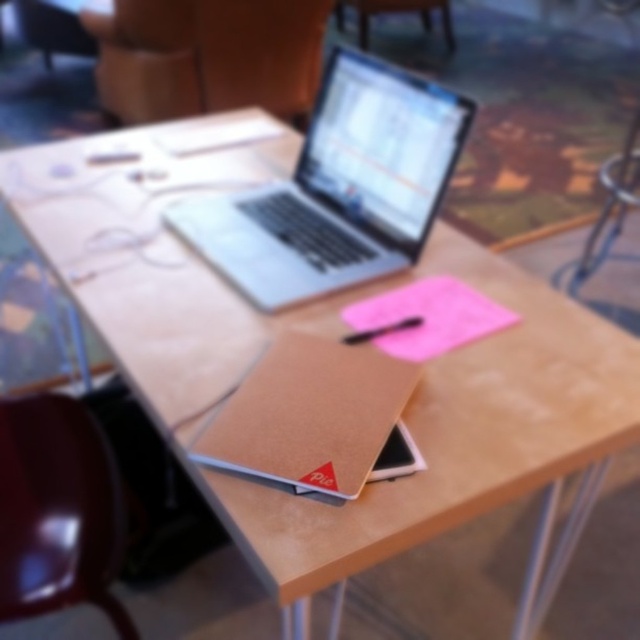
How far apart are brown kraft notepad at center and matte brown chair at upper center?

They are 4.04 meters apart.

Is brown kraft notepad at center to the right of matte brown chair at upper center from the viewer's perspective?

No, brown kraft notepad at center is not to the right of matte brown chair at upper center.

Is point (280, 397) less distant than point (337, 19)?

That is True.

Find the location of a particular element. brown kraft notepad at center is located at coordinates (308, 413).

Is silver metallic laptop at center wider than pink matte notepad at center?

Yes.

Can you confirm if silver metallic laptop at center is bigger than pink matte notepad at center?

Indeed, silver metallic laptop at center has a larger size compared to pink matte notepad at center.

Locate an element on the screen. This screenshot has width=640, height=640. silver metallic laptop at center is located at coordinates (339, 188).

Is matte red chair at lower left positioned at the back of pink matte notepad at center?

Yes.

Who is taller, matte red chair at lower left or pink matte notepad at center?

With more height is matte red chair at lower left.

In order to click on matte red chair at lower left in this screenshot , I will do `click(58, 509)`.

Locate an element on the screen. The image size is (640, 640). matte red chair at lower left is located at coordinates (58, 509).